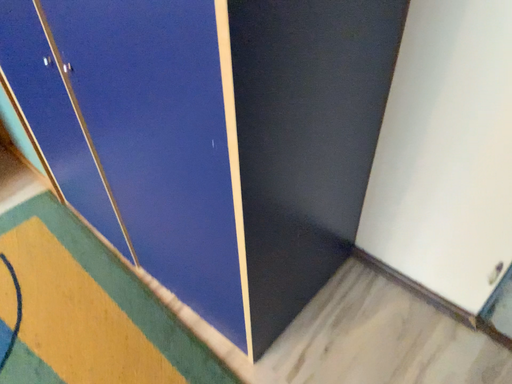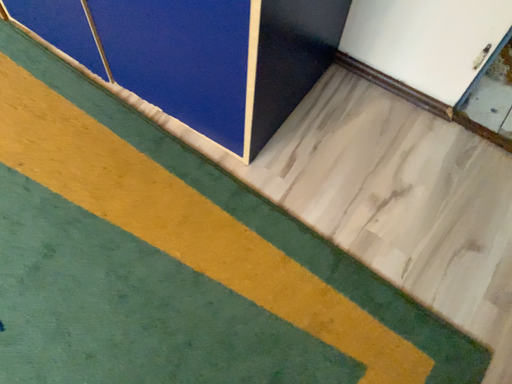
Question: Which way did the camera rotate in the video?

Choices:
 (A) rotated downward
 (B) rotated upward

Answer: (A)